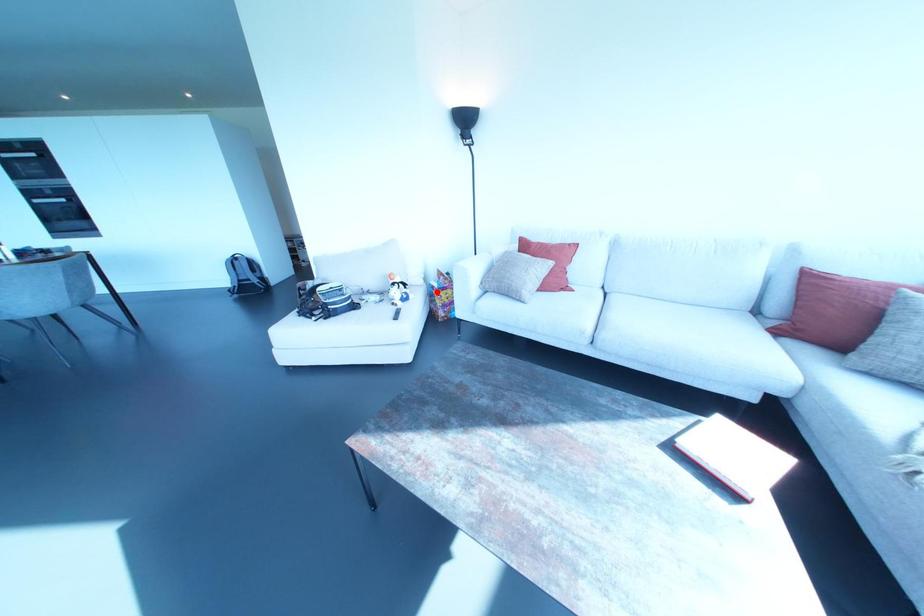
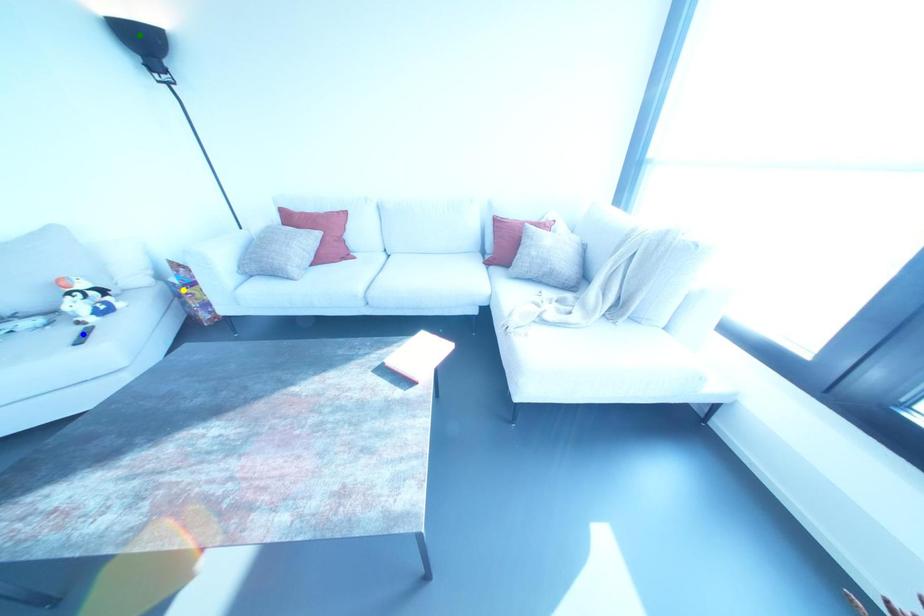
Question: I am providing you with two images of the same scene from different viewpoints. A red point is marked on the first image. You are given multiple points on the second image. In image 2, which mark is for the same physical point as the one in image 1?

Choices:
 (A) green point
 (B) blue point
 (C) yellow point

Answer: (C)